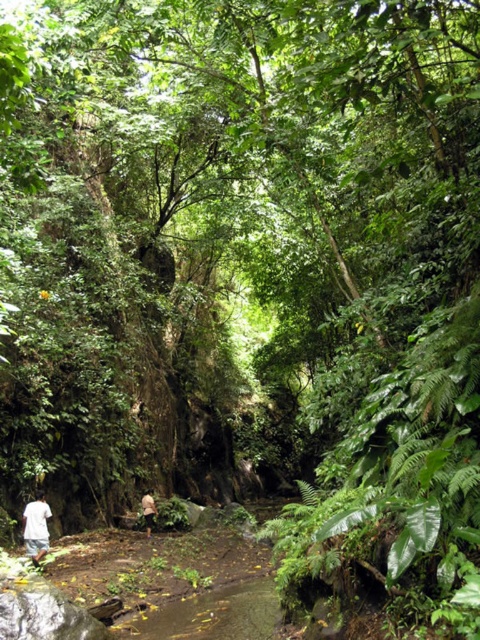
Which is behind, point (48, 516) or point (145, 500)?

Point (145, 500)

Between white cotton shirt at lower left and brown fabric person at center, which one appears on the right side from the viewer's perspective?

Positioned to the right is brown fabric person at center.

Does point (31, 509) lie in front of point (149, 492)?

Yes, it is in front of point (149, 492).

Locate an element on the screen. The image size is (480, 640). white cotton shirt at lower left is located at coordinates tap(36, 528).